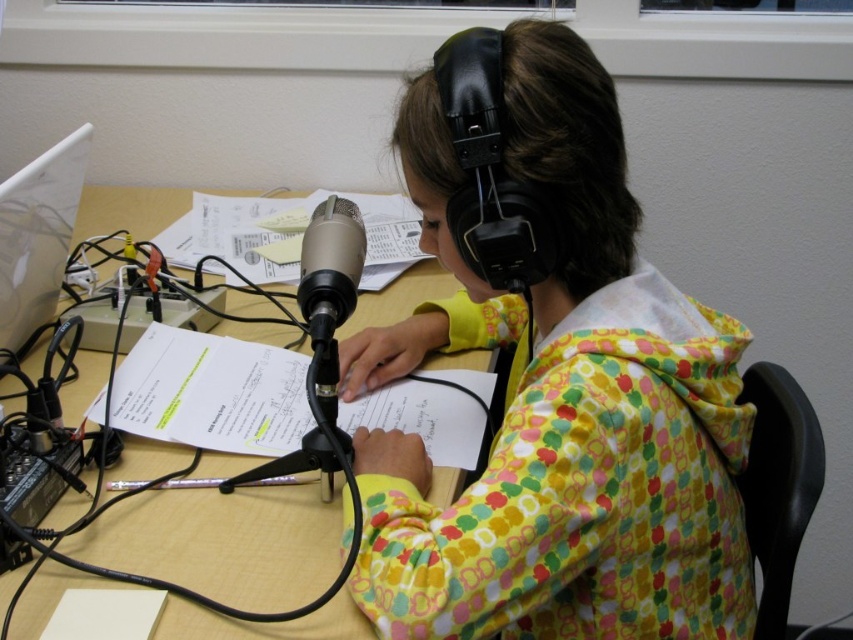
Does white paper at center have a lesser width compared to white plastic laptop at left?

No, white paper at center is not thinner than white plastic laptop at left.

Which is below, white paper at center or white plastic laptop at left?

Positioned lower is white plastic laptop at left.

Which is behind, point (257, 202) or point (0, 340)?

Positioned behind is point (257, 202).

Find the location of a particular element. This screenshot has width=853, height=640. white paper at center is located at coordinates (238, 234).

Is yellow floral hoodie at center further to the viewer compared to white paper at center?

No, yellow floral hoodie at center is closer to the viewer.

How distant is yellow floral hoodie at center from white paper at center?

21.81 inches

Measure the distance between point (621, 298) and camera.

A distance of 83.03 centimeters exists between point (621, 298) and camera.

At what (x,y) coordinates should I click in order to perform the action: click on yellow floral hoodie at center. Please return your answer as a coordinate pair (x, y). Image resolution: width=853 pixels, height=640 pixels. Looking at the image, I should click on (558, 403).

Can you confirm if white plastic laptop at left is positioned below black matte microphone at center?

Actually, white plastic laptop at left is above black matte microphone at center.

Is white plastic laptop at left positioned at the back of black matte microphone at center?

Yes, it is behind black matte microphone at center.

What do you see at coordinates (38, 236) in the screenshot? Image resolution: width=853 pixels, height=640 pixels. I see `white plastic laptop at left` at bounding box center [38, 236].

You are a GUI agent. You are given a task and a screenshot of the screen. Output one action in this format:
    pyautogui.click(x=<x>, y=<y>)
    Task: Click on the white plastic laptop at left
    The width and height of the screenshot is (853, 640).
    Given the screenshot: What is the action you would take?
    pyautogui.click(x=38, y=236)